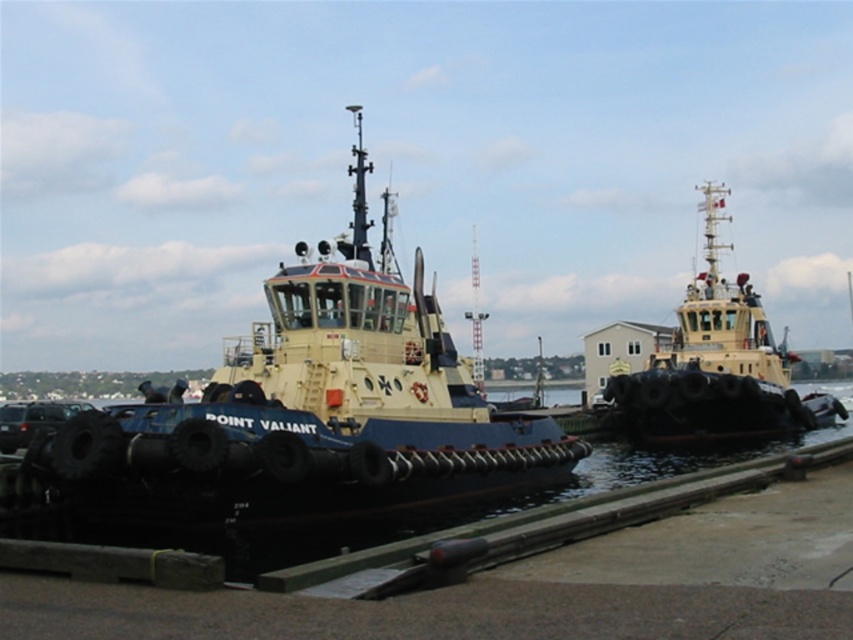
Question: Can you confirm if yellow matte tugboat at center is positioned below yellow matte tugboat at upper right?

Choices:
 (A) yes
 (B) no

Answer: (B)

Question: Which point is farther to the camera?

Choices:
 (A) yellow matte tugboat at center
 (B) yellow matte tugboat at upper right

Answer: (B)

Question: Can you confirm if yellow matte tugboat at center is positioned above yellow matte tugboat at upper right?

Choices:
 (A) no
 (B) yes

Answer: (B)

Question: Considering the relative positions of yellow matte tugboat at center and yellow matte tugboat at upper right in the image provided, where is yellow matte tugboat at center located with respect to yellow matte tugboat at upper right?

Choices:
 (A) above
 (B) below

Answer: (A)